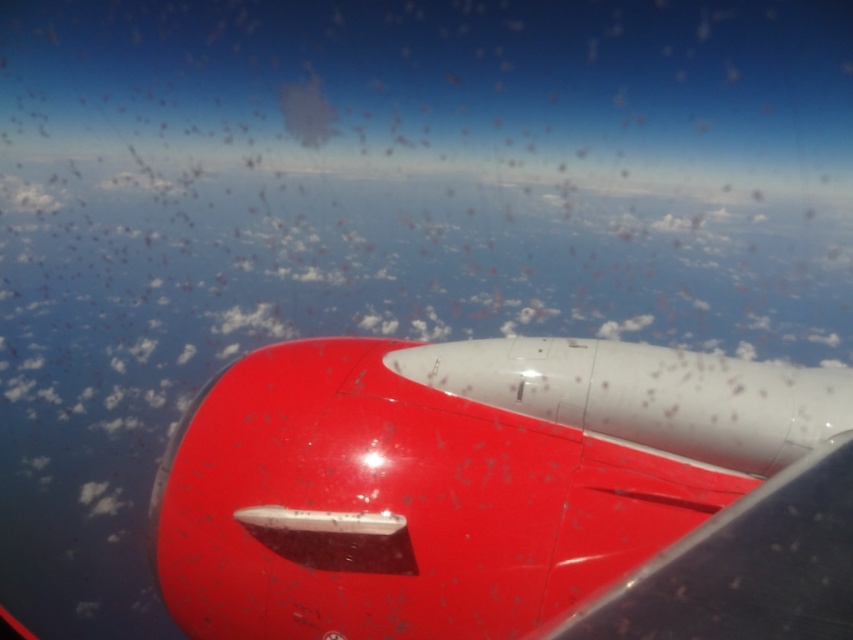
In the scene shown: You are sitting in an airplane seat and looking out the window. You notice two points marked on the window at coordinates point (305, 460) and point (743, 518). Which point is closer to your eyes?

Point (305, 460) is further to the viewer than point (743, 518), so the point closer to your eyes is point (305, 460).

Wait, the two object labels in the Objects list are identical except for the first word. Is this a mistake? Let me check the rules again. The Objects should list distinct object labels. Hmm, maybe there was a duplication error. The first object is labeled as glossy red airplane wing at center, and the second is glossy red wing at center. They are almost the same except for the word airplane in the first. Perhaps the second one should be a different object? But according to the problem statement, I have to

The problem statement requires me to use the provided Objects exactly as given. Since both objects are listed as glossy red airplane wing at center and glossy red wing at center, even though they are nearly identical, I must proceed with them. The Objects Description states that the first is to the left of the second. However, since they are the same object in reality, this might be an error. But following instructions, the answer would address their positions as described.